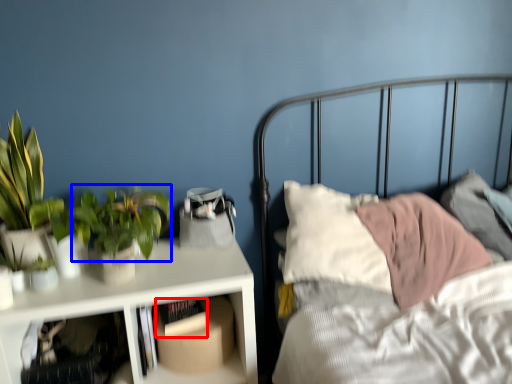
Question: Among these objects, which one is farthest to the camera, book (highlighted by a red box) or vegetation (highlighted by a blue box)?

Choices:
 (A) book
 (B) vegetation

Answer: (A)